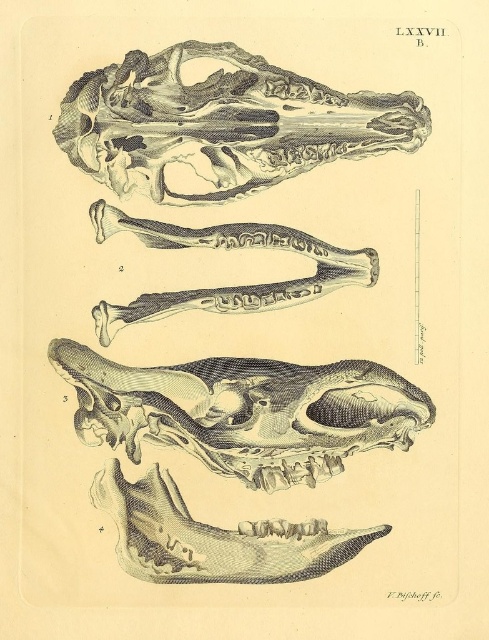
Looking at this image, you are a medical student analyzing the anatomical illustration. You observe the gray textured skull at center and the gray etched skull at upper center. Which of these two skulls has a larger height?

The gray textured skull at center has a greater height compared to the gray etched skull at upper center.

Based on the scene description, what is the spatial relationship between the gray textured skull at center and the gray etched skull at upper center?

The gray textured skull at center is located below the gray etched skull at upper center.